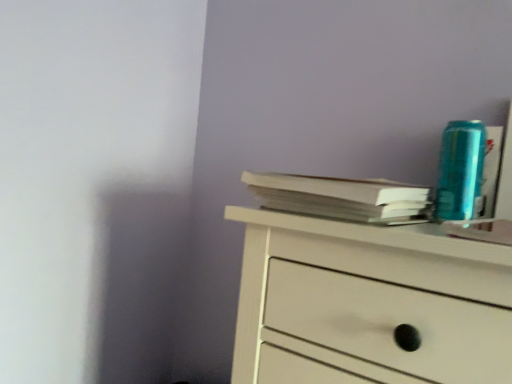
Question: Should I look upward or downward to see white paper at upper right?

Choices:
 (A) down
 (B) up

Answer: (A)

Question: Is white paper at upper right outside of teal metallic can at upper right?

Choices:
 (A) yes
 (B) no

Answer: (A)

Question: Is teal metallic can at upper right completely or partially inside white paper at upper right?

Choices:
 (A) no
 (B) yes

Answer: (A)

Question: From a real-world perspective, is white paper at upper right on top of teal metallic can at upper right?

Choices:
 (A) no
 (B) yes

Answer: (A)

Question: Considering the relative positions of white paper at upper right and teal metallic can at upper right in the image provided, is white paper at upper right to the left of teal metallic can at upper right from the viewer's perspective?

Choices:
 (A) yes
 (B) no

Answer: (A)

Question: From the image's perspective, is white paper at upper right over teal metallic can at upper right?

Choices:
 (A) no
 (B) yes

Answer: (A)

Question: From the image's perspective, is white paper at upper right under teal metallic can at upper right?

Choices:
 (A) no
 (B) yes

Answer: (B)

Question: Does teal metallic can at upper right have a lesser height compared to white paper at upper right?

Choices:
 (A) no
 (B) yes

Answer: (A)

Question: Is teal metallic can at upper right smaller than white paper at upper right?

Choices:
 (A) no
 (B) yes

Answer: (B)

Question: Considering the relative positions of teal metallic can at upper right and white paper at upper right in the image provided, is teal metallic can at upper right to the right of white paper at upper right from the viewer's perspective?

Choices:
 (A) no
 (B) yes

Answer: (B)

Question: Considering the relative sizes of teal metallic can at upper right and white paper at upper right in the image provided, is teal metallic can at upper right taller than white paper at upper right?

Choices:
 (A) yes
 (B) no

Answer: (A)

Question: Is teal metallic can at upper right thinner than white paper at upper right?

Choices:
 (A) no
 (B) yes

Answer: (B)

Question: Is white paper at upper right located within teal metallic can at upper right?

Choices:
 (A) yes
 (B) no

Answer: (B)

Question: Considering the positions of white paper at upper right and teal metallic can at upper right in the image, is white paper at upper right taller or shorter than teal metallic can at upper right?

Choices:
 (A) short
 (B) tall

Answer: (A)